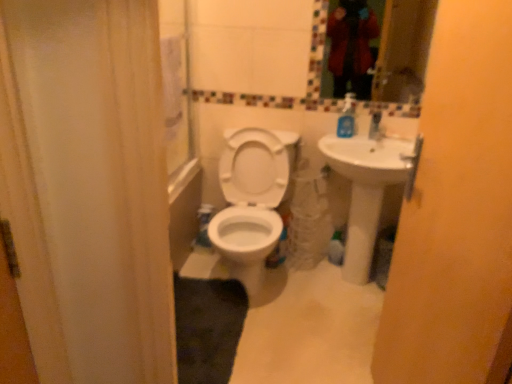
The width and height of the screenshot is (512, 384). Find the location of `vacant space in front of white glossy sink at right`. vacant space in front of white glossy sink at right is located at coordinates (332, 327).